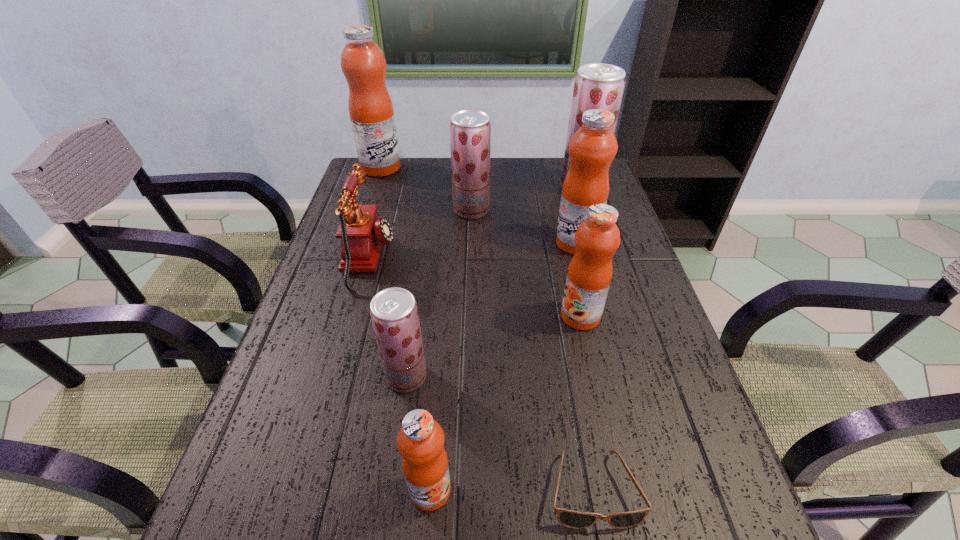
Locate which fruit juice ranks in proximity to the second nearest strawberry fruit juice. Please provide its 2D coordinates. Your answer should be formatted as a tuple, i.e. [(x, y)], where the tuple contains the x and y coordinates of a point satisfying the conditions above.

[(593, 147)]

Select which fruit juice is the second closest to the sixth farthest object. Please provide its 2D coordinates. Your answer should be formatted as a tuple, i.e. [(x, y)], where the tuple contains the x and y coordinates of a point satisfying the conditions above.

[(394, 313)]

The width and height of the screenshot is (960, 540). Identify the location of orange fruit juice identified as the closest to the fifth farthest fruit juice. (593, 147).

Point out which orange fruit juice is positioned as the second nearest to the leftmost strawberry fruit juice. Please provide its 2D coordinates. Your answer should be formatted as a tuple, i.e. [(x, y)], where the tuple contains the x and y coordinates of a point satisfying the conditions above.

[(597, 238)]

Choose which strawberry fruit juice is the second nearest neighbor to the sunglasses. Please provide its 2D coordinates. Your answer should be formatted as a tuple, i.e. [(x, y)], where the tuple contains the x and y coordinates of a point satisfying the conditions above.

[(470, 130)]

The width and height of the screenshot is (960, 540). In order to click on strawberry fruit juice identified as the second closest to the telephone in this screenshot , I will do `click(394, 313)`.

This screenshot has width=960, height=540. I want to click on vacant region that satisfies the following two spatial constraints: 1. on the front label of the tallest object; 2. on the left side of the farthest strawberry fruit juice, so click(x=374, y=187).

The width and height of the screenshot is (960, 540). In order to click on free point that satisfies the following two spatial constraints: 1. on the front label of the fourth nearest fruit juice; 2. on the dial of the telephone in this screenshot , I will do `click(580, 259)`.

The width and height of the screenshot is (960, 540). Find the location of `free space that satisfies the following two spatial constraints: 1. on the back side of the biggest strawberry fruit juice; 2. on the right side of the second strawberry fruit juice from right to left`. free space that satisfies the following two spatial constraints: 1. on the back side of the biggest strawberry fruit juice; 2. on the right side of the second strawberry fruit juice from right to left is located at coordinates (472, 187).

Find the location of a particular element. free space that satisfies the following two spatial constraints: 1. on the front label of the fourth farthest fruit juice; 2. on the dial of the telephone is located at coordinates (580, 259).